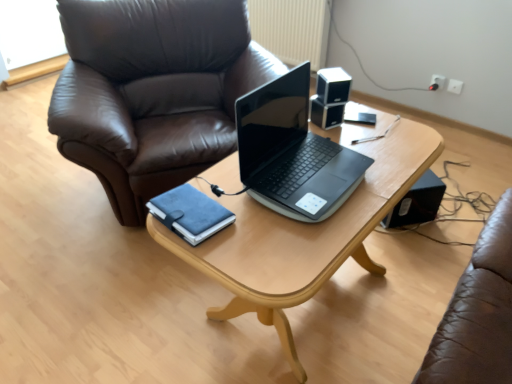
Where is `free space in front of sleek black laptop at center`? The width and height of the screenshot is (512, 384). free space in front of sleek black laptop at center is located at coordinates (289, 241).